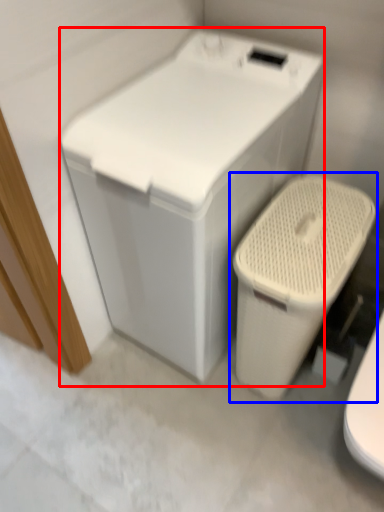
Question: Which point is closer to the camera, washing machine (highlighted by a red box) or toilet (highlighted by a blue box)?

Choices:
 (A) washing machine
 (B) toilet

Answer: (A)